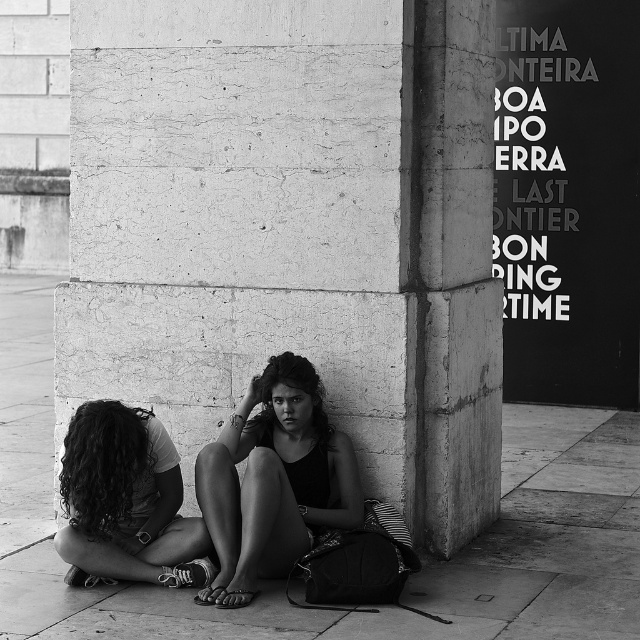
What do you see at coordinates (342, 612) in the screenshot? I see `smooth concrete pavement at lower center` at bounding box center [342, 612].

Measure the distance between smooth concrete pavement at lower center and camera.

smooth concrete pavement at lower center and camera are 7.71 meters apart from each other.

Image resolution: width=640 pixels, height=640 pixels. I want to click on smooth concrete pavement at lower center, so click(342, 612).

Image resolution: width=640 pixels, height=640 pixels. Describe the element at coordinates (273, 481) in the screenshot. I see `smooth black tank top at center` at that location.

How distant is smooth black tank top at center from curly hair at lower left?

smooth black tank top at center is 23.16 inches away from curly hair at lower left.

Is point (269, 563) behind point (157, 452)?

No, it is not.

Find the location of a particular element. The image size is (640, 640). smooth black tank top at center is located at coordinates (273, 481).

Between point (204, 257) and point (602, 465), which one is positioned behind?

Point (602, 465)

Is smooth concrete pillar at center thinner than smooth concrete pavement at lower center?

Correct, smooth concrete pillar at center's width is less than smooth concrete pavement at lower center's.

Which is behind, point (134, 12) or point (525, 561)?

Positioned behind is point (134, 12).

This screenshot has width=640, height=640. I want to click on smooth concrete pillar at center, so click(x=292, y=227).